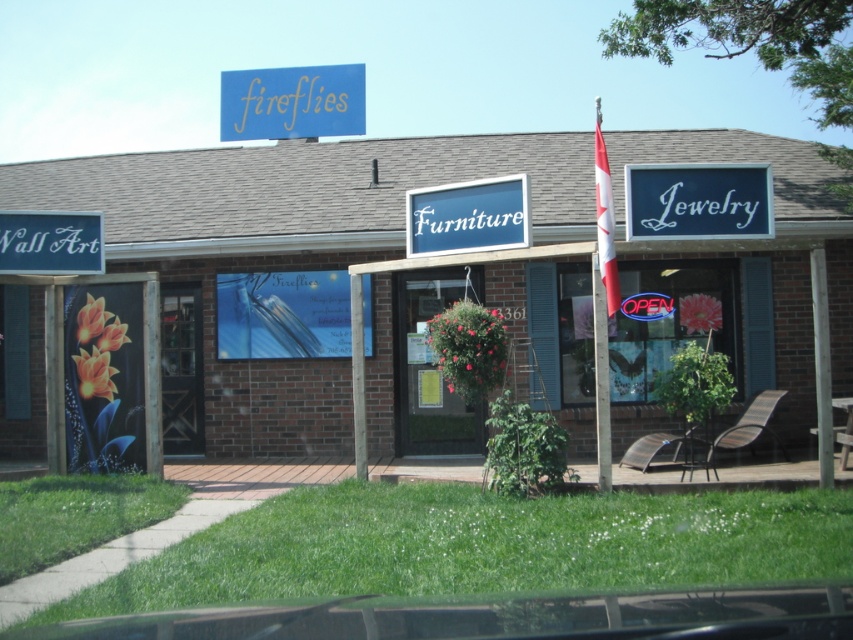
You are a customer entering the Fireflies store and looking at the brick wall at center and the blue matte sign at upper center. Which object is located higher up in the image?

The blue matte sign at upper center is located higher up because the brick wall at center is positioned under it.

You are standing in front of the Fireflies store and want to take a photo of the entrance. The store has a sign on the left for Wall Art, one in the center for Furniture, and one on the right for Jewelry. You need to ensure your camera is positioned exactly 12 meters away to capture the entire storefront clearly. Is your current position at point (427, 301) suitable for this?

The point (427, 301) is 12.37 meters from the camera, which is slightly further than the required 12 meters. Therefore, moving a little closer would ensure the entire storefront is captured clearly.

You are a delivery person who needs to place a 3.5 meter long ladder horizontally between the brick wall at center and the white matte wall art at left. Can the ladder fit without overlapping either object?

The distance between the brick wall at center and the white matte wall art at left is 3.61 meters. Since the ladder is 3.5 meters long, it can fit between them without overlapping either object as there is enough space.